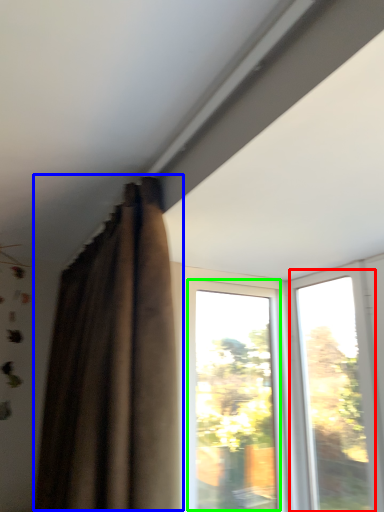
Question: Considering the real-world distances, which object is farthest from window (highlighted by a red box)? curtain (highlighted by a blue box) or window (highlighted by a green box)?

Choices:
 (A) curtain
 (B) window

Answer: (A)